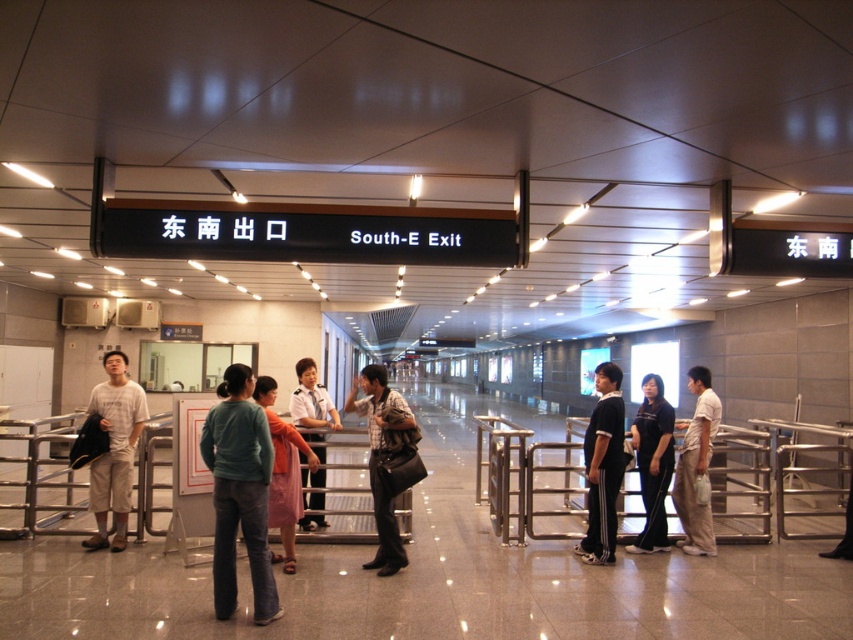
Question: Considering the relative positions of plaid shirt at center and black athletic wear at center in the image provided, where is plaid shirt at center located with respect to black athletic wear at center?

Choices:
 (A) above
 (B) below

Answer: (B)

Question: Estimate the real-world distances between objects in this image. Which object is farther from the plaid shirt at center?

Choices:
 (A) black fabric pants at center
 (B) white uniform at center

Answer: (A)

Question: Can you confirm if light brown cotton pants at center is positioned above white uniform at center?

Choices:
 (A) no
 (B) yes

Answer: (A)

Question: Which point is closer to the camera taking this photo?

Choices:
 (A) (x=293, y=458)
 (B) (x=642, y=460)
 (C) (x=108, y=493)

Answer: (A)

Question: Which of the following is the closest to the observer?

Choices:
 (A) click(96, 525)
 (B) click(219, 381)
 (C) click(323, 394)

Answer: (C)

Question: Does light beige shorts at center have a lesser width compared to black fabric pants at center?

Choices:
 (A) no
 (B) yes

Answer: (A)